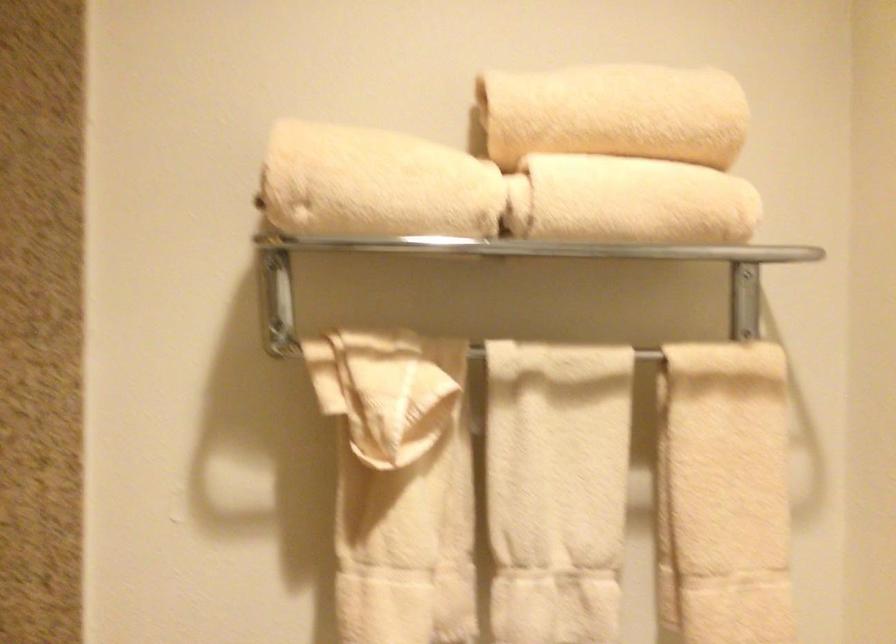
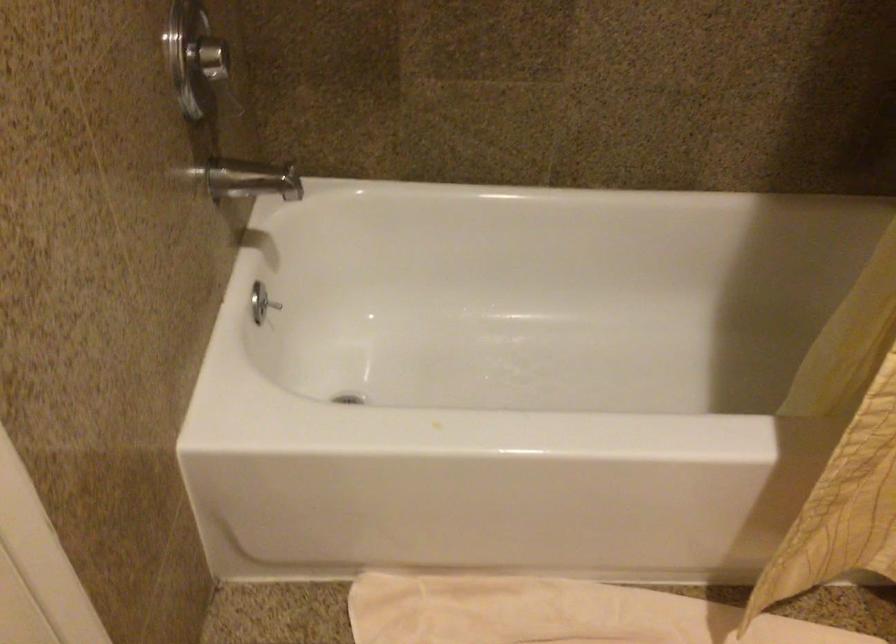
Based on the continuous images, in which direction is the camera rotating?

The rotation direction of the camera is left-down.